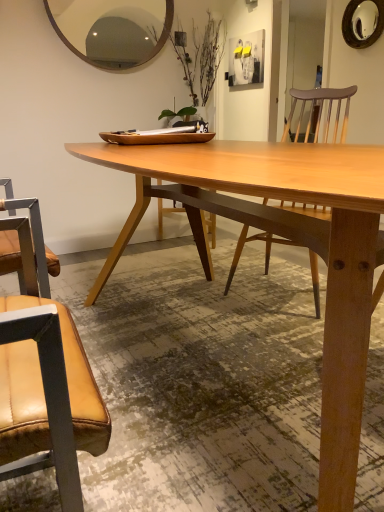
Question: Does point (119, 37) appear closer or farther from the camera than point (16, 472)?

Choices:
 (A) farther
 (B) closer

Answer: (A)

Question: From the image's perspective, is wooden mirror at upper center, the first mirror in the bottom-to-top sequence, positioned above or below leather at left?

Choices:
 (A) below
 (B) above

Answer: (B)

Question: Which object is positioned closest to the leather at left?

Choices:
 (A) wooden mirror at upper right, which ranks as the 1th mirror in back-to-front order
 (B) matte white picture frame at upper center
 (C) natural wood table at center
 (D) wooden mirror at upper center, the second mirror in the right-to-left sequence

Answer: (C)

Question: Which of these objects is positioned closest to the wooden mirror at upper center, which is the 2th mirror in top-to-bottom order?

Choices:
 (A) leather at left
 (B) matte white picture frame at upper center
 (C) wooden mirror at upper right, the 2th mirror viewed from the front
 (D) natural wood table at center

Answer: (D)